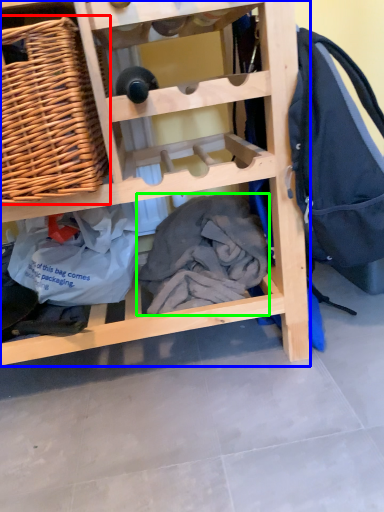
Question: Which object is the farthest from picnic basket (highlighted by a red box)? Choose among these: furniture (highlighted by a blue box) or clothing (highlighted by a green box).

Choices:
 (A) furniture
 (B) clothing

Answer: (B)